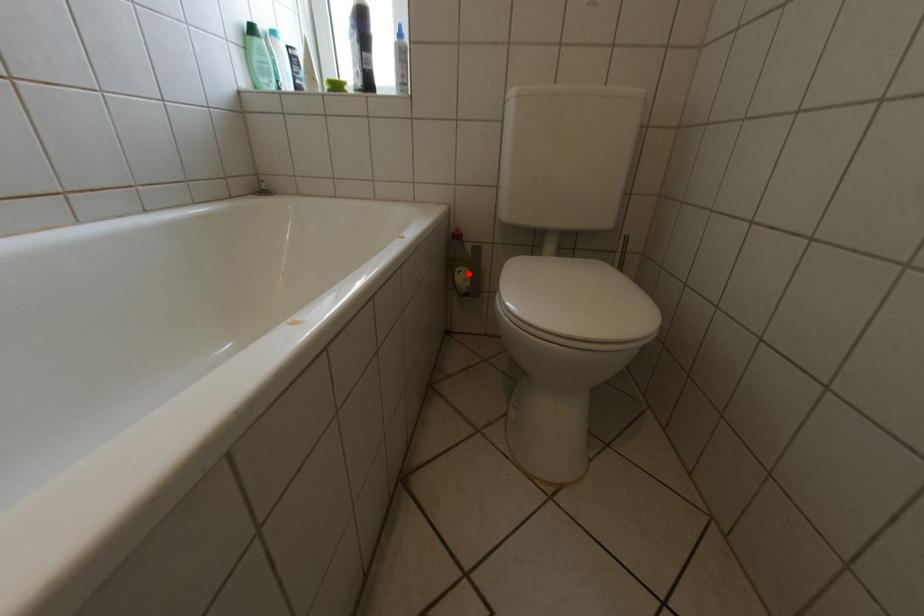
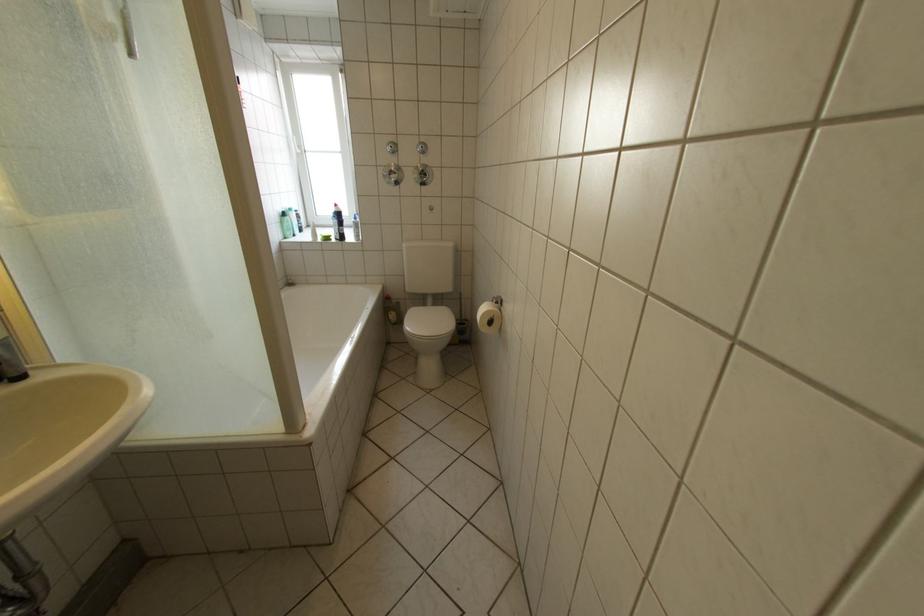
Where in the second image is the point corresponding to the highlighted location from the first image?

(402, 315)